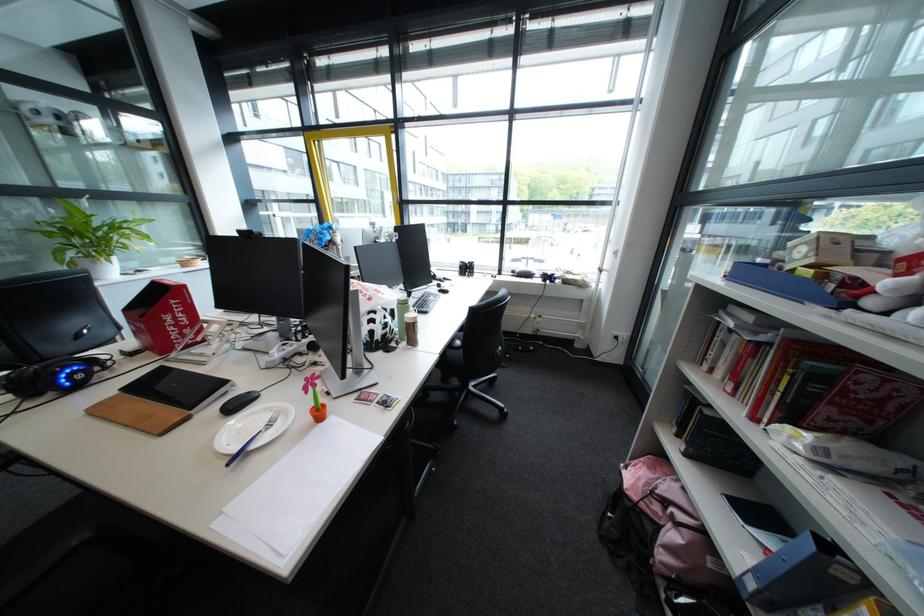
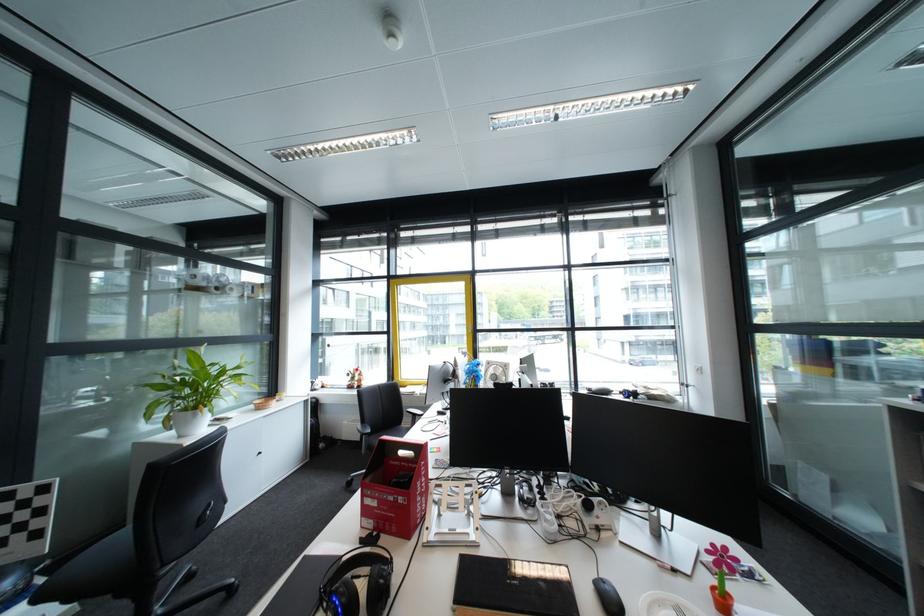
Question: The images are taken continuously from a first-person perspective. In which direction are you moving?

Choices:
 (A) Left
 (B) Right
 (C) Forward
 (D) Backward

Answer: (A)